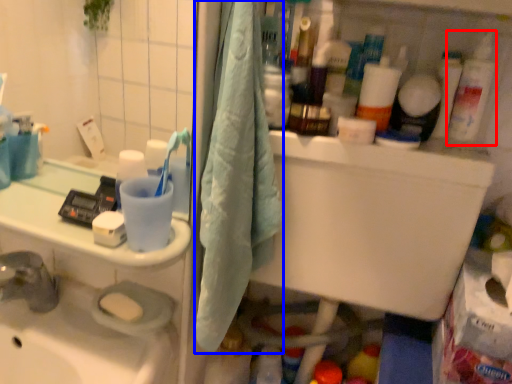
Question: Which object is closer to the camera taking this photo, cleaning product (highlighted by a red box) or bath towel (highlighted by a blue box)?

Choices:
 (A) cleaning product
 (B) bath towel

Answer: (B)